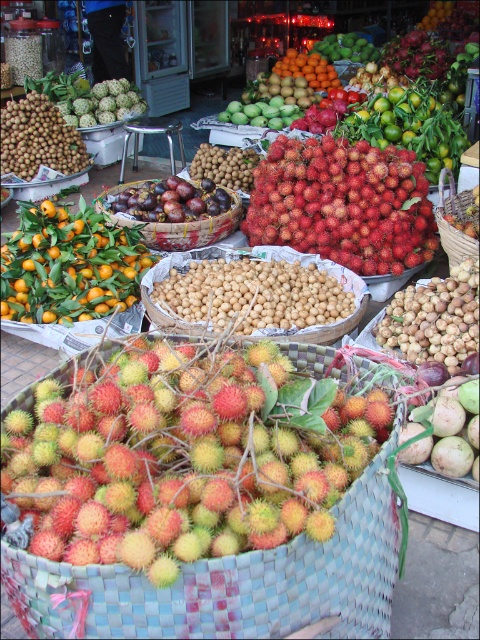
Is smooth brown longan at upper left above smooth orange rambutan at center?

Incorrect, smooth brown longan at upper left is not positioned above smooth orange rambutan at center.

Between smooth brown longan at upper left and smooth orange rambutan at center, which one appears on the right side from the viewer's perspective?

smooth orange rambutan at center

Is point (12, 125) positioned behind point (315, 70)?

That is False.

Where is `smooth brown longan at upper left`? smooth brown longan at upper left is located at coordinates (38, 138).

Measure the distance between smooth brown longan at upper left and rustic woven basket at center.

The distance of smooth brown longan at upper left from rustic woven basket at center is 3.48 meters.

Which of these two, smooth brown longan at upper left or rustic woven basket at center, stands shorter?

Standing shorter between the two is rustic woven basket at center.

What do you see at coordinates (38, 138) in the screenshot? This screenshot has height=640, width=480. I see `smooth brown longan at upper left` at bounding box center [38, 138].

The image size is (480, 640). Identify the location of smooth brown longan at upper left. (38, 138).

Can you confirm if red matte rambutan at center is positioned above smooth brown longan at upper left?

No, red matte rambutan at center is not above smooth brown longan at upper left.

Is red matte rambutan at center positioned in front of smooth brown longan at upper left?

Yes, red matte rambutan at center is closer to the viewer.

Is point (263, 241) less distant than point (35, 92)?

Yes.

You are a GUI agent. You are given a task and a screenshot of the screen. Output one action in this format:
    pyautogui.click(x=<x>, y=<y>)
    Task: Click on the red matte rambutan at center
    
    Given the screenshot: What is the action you would take?
    pyautogui.click(x=343, y=204)